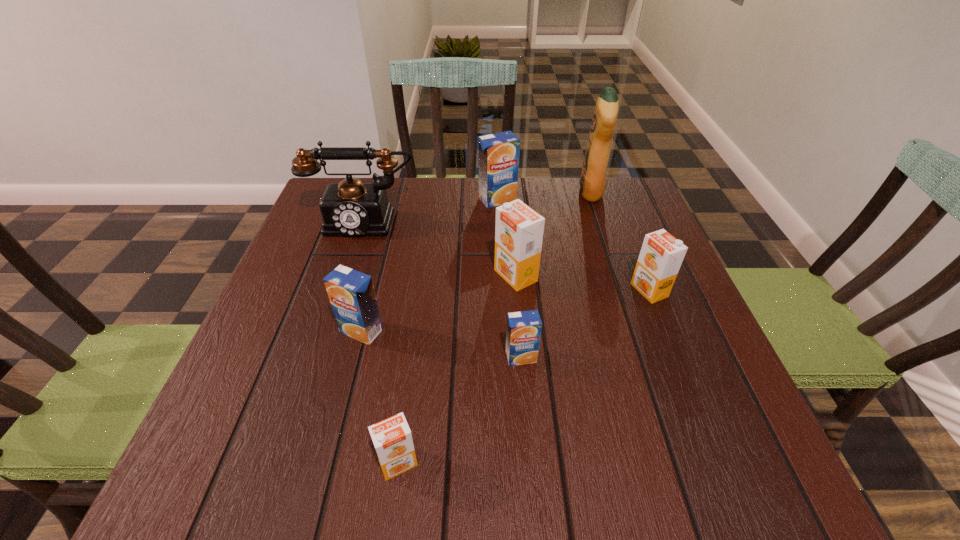
This screenshot has height=540, width=960. In order to click on orange juice positioned at the right edge in this screenshot , I will do `click(661, 255)`.

This screenshot has height=540, width=960. What are the coordinates of `object positioned at the far left corner` in the screenshot? It's located at (350, 208).

The image size is (960, 540). Identify the location of object at the far right corner. (593, 174).

Where is `vacant area at the far edge`? Image resolution: width=960 pixels, height=540 pixels. vacant area at the far edge is located at coordinates (420, 208).

Where is `free region at the near edge of the desktop`? free region at the near edge of the desktop is located at coordinates (652, 468).

Image resolution: width=960 pixels, height=540 pixels. In the image, there is a desktop. In order to click on free space at the left edge in this screenshot , I will do `click(291, 251)`.

Locate an element on the screen. vacant space at the far left corner of the desktop is located at coordinates 315,227.

In the image, there is a desktop. At what (x,y) coordinates should I click in order to perform the action: click on vacant space at the near left corner. Please return your answer as a coordinate pair (x, y). The image size is (960, 540). Looking at the image, I should click on (196, 476).

Find the location of a particular element. vacant space at the far right corner is located at coordinates (638, 195).

The width and height of the screenshot is (960, 540). I want to click on vacant region between the nearest blue orange_juice and the rightmost orange orange juice, so click(585, 324).